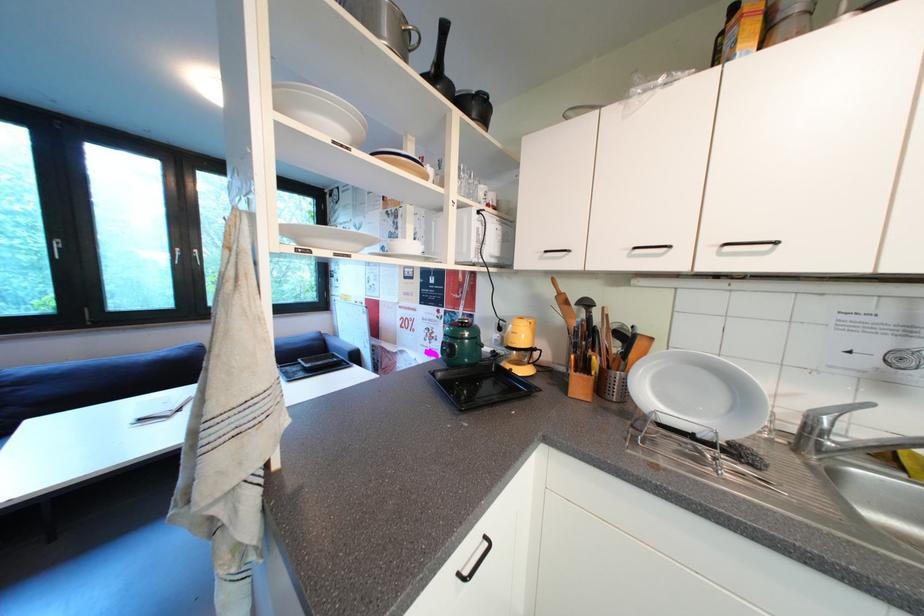
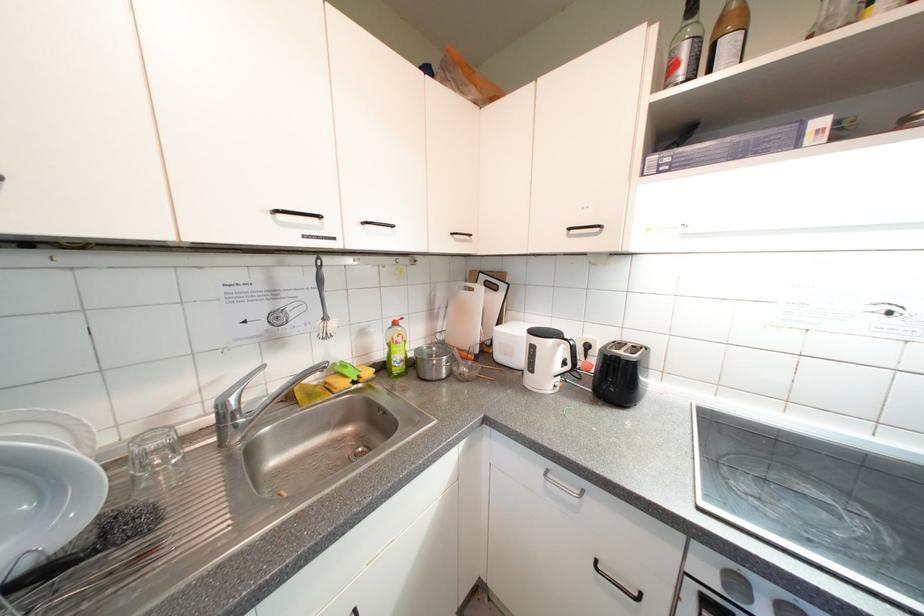
Question: The first image is from the beginning of the video and the second image is from the end. How did the camera likely rotate when shooting the video?

Choices:
 (A) Left
 (B) Right
 (C) Up
 (D) Down

Answer: (B)